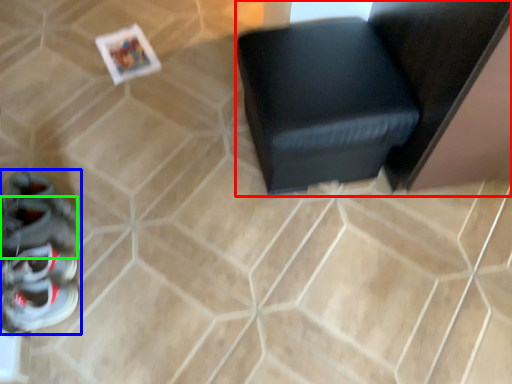
Question: Which is farther away from furniture (highlighted by a red box)? footwear (highlighted by a blue box) or shoe (highlighted by a green box)?

Choices:
 (A) footwear
 (B) shoe

Answer: (B)